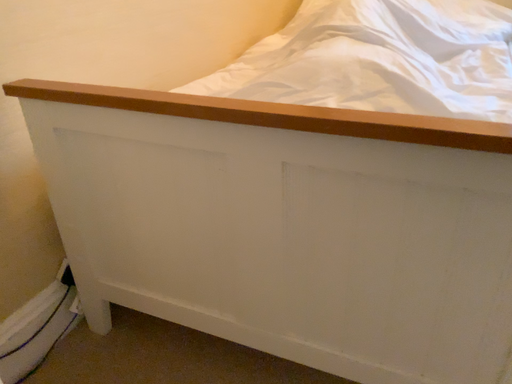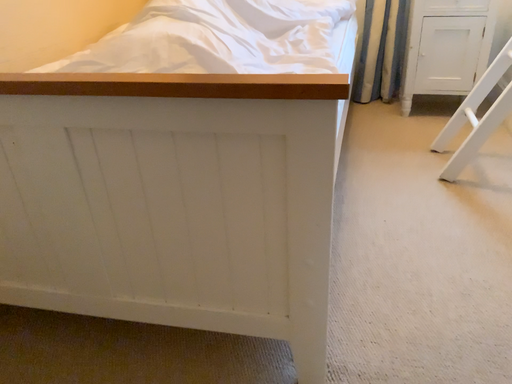
Question: Which way did the camera rotate in the video?

Choices:
 (A) rotated right
 (B) rotated left

Answer: (A)